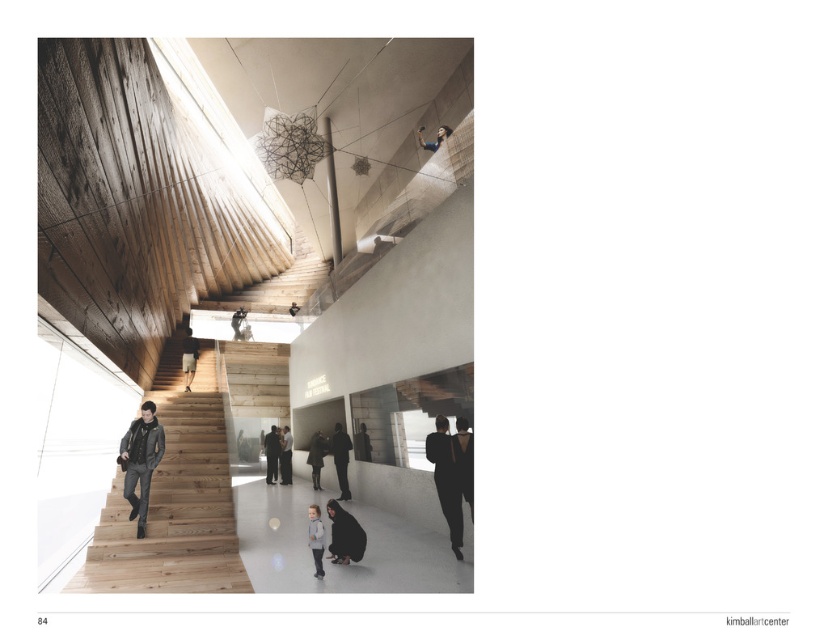
Is point (437, 456) closer to camera compared to point (348, 563)?

No.

Who is higher up, dark gray suit at lower right or dark matte jacket at lower center?

dark gray suit at lower right is above.

Does point (425, 452) lie in front of point (357, 534)?

No, it is behind (357, 534).

Identify the location of dark gray suit at lower right. The width and height of the screenshot is (828, 640). (446, 481).

Can you confirm if leather jacket at lower left is smaller than dark gray jacket at center?

Actually, leather jacket at lower left might be larger than dark gray jacket at center.

Can you confirm if leather jacket at lower left is bigger than dark gray jacket at center?

Indeed, leather jacket at lower left has a larger size compared to dark gray jacket at center.

The height and width of the screenshot is (640, 828). Identify the location of leather jacket at lower left. (140, 461).

Is dark brown leather jacket at lower right further to camera compared to dark gray pants at lower center?

No.

Which is below, dark brown leather jacket at lower right or dark gray pants at lower center?

dark gray pants at lower center

Who is more forward, (467, 422) or (343, 492)?

Point (467, 422) is in front.

At what (x,y) coordinates should I click in order to perform the action: click on dark brown leather jacket at lower right. Please return your answer as a coordinate pair (x, y). This screenshot has height=640, width=828. Looking at the image, I should click on (465, 460).